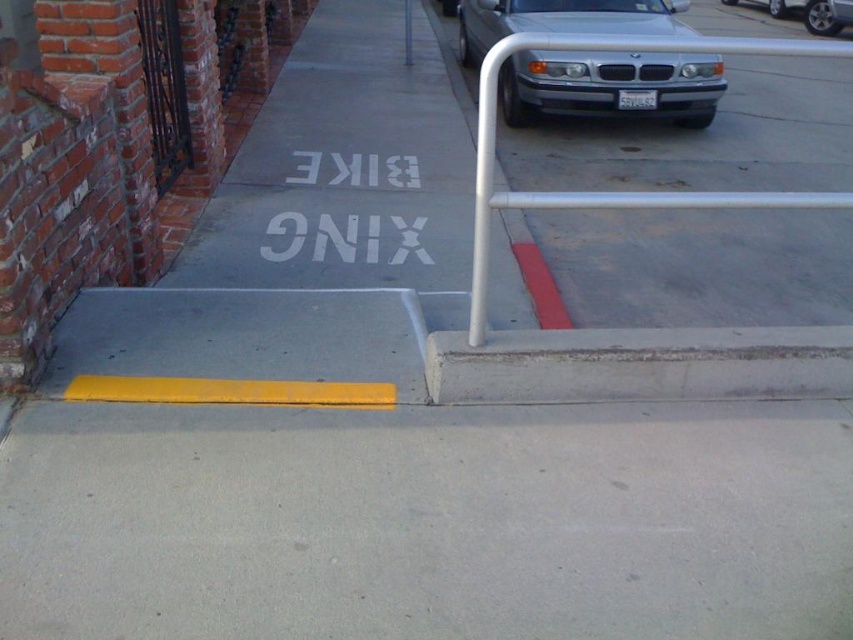
Question: Estimate the real-world distances between objects in this image. Which object is farther from the silver metallic car at upper right?

Choices:
 (A) silver metallic car at upper center
 (B) concrete at lower center

Answer: (B)

Question: Does concrete at lower center come behind yellow painted pole at upper center?

Choices:
 (A) no
 (B) yes

Answer: (A)

Question: Which object is positioned farthest from the yellow painted pole at upper center?

Choices:
 (A) silver metallic car at upper center
 (B) concrete at lower center

Answer: (B)

Question: Which point appears farthest from the camera in this image?

Choices:
 (A) (503, 113)
 (B) (837, 4)

Answer: (B)

Question: Can you confirm if concrete at lower center is positioned below silver metallic car at upper center?

Choices:
 (A) no
 (B) yes

Answer: (B)

Question: Where is silver metallic car at upper right located in relation to yellow painted pole at upper center in the image?

Choices:
 (A) below
 (B) above

Answer: (B)